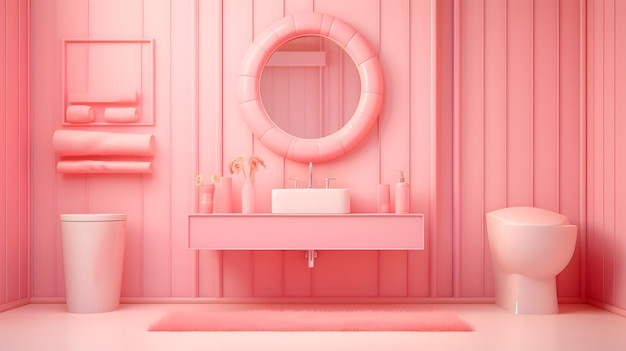
I want to click on pink vase, so click(254, 202).